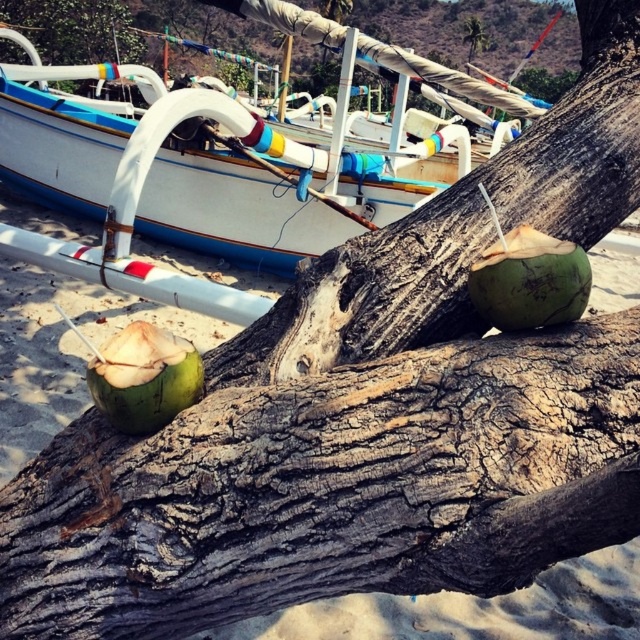
Question: Which of the following is the closest to the observer?

Choices:
 (A) (72, 38)
 (B) (468, 20)
 (C) (150, 394)
 (D) (12, 99)

Answer: (C)

Question: Which object is positioned farthest from the brown rough tree trunk at upper left?

Choices:
 (A) white painted wood boat at upper left
 (B) green matte coconut at center
 (C) green rough bark tree trunk at center
 (D) green rough coconut at center

Answer: (D)

Question: Observing the image, what is the correct spatial positioning of green rough bark tree trunk at center in reference to green rough coconut at center?

Choices:
 (A) above
 (B) below

Answer: (B)

Question: Which of the following is the closest to the observer?

Choices:
 (A) white painted wood boat at upper left
 (B) green rough coconut at center

Answer: (B)

Question: Where is green rough bark tree trunk at center located in relation to green rough bark tree at upper center in the image?

Choices:
 (A) right
 (B) left

Answer: (B)

Question: Does green matte coconut at center appear over green rough bark tree at upper center?

Choices:
 (A) yes
 (B) no

Answer: (B)